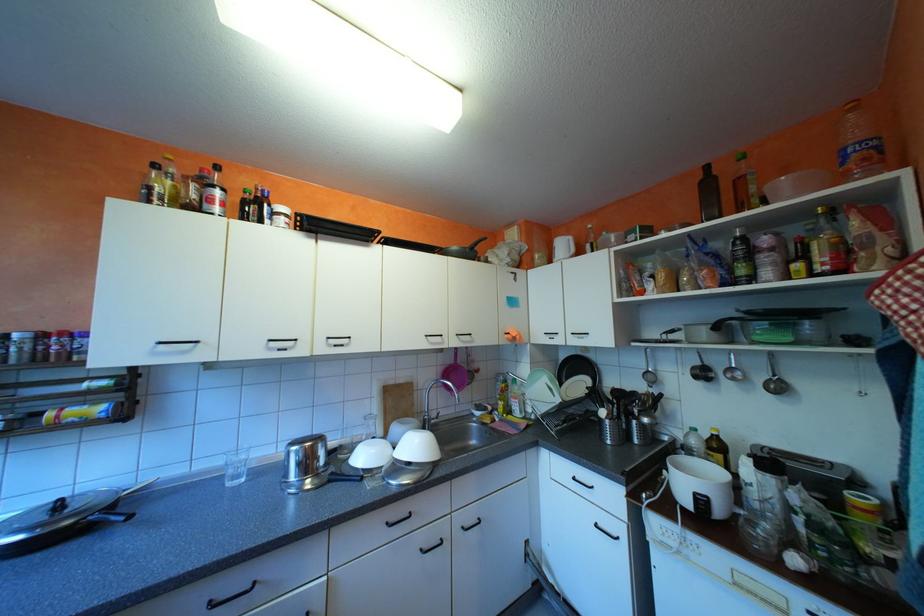
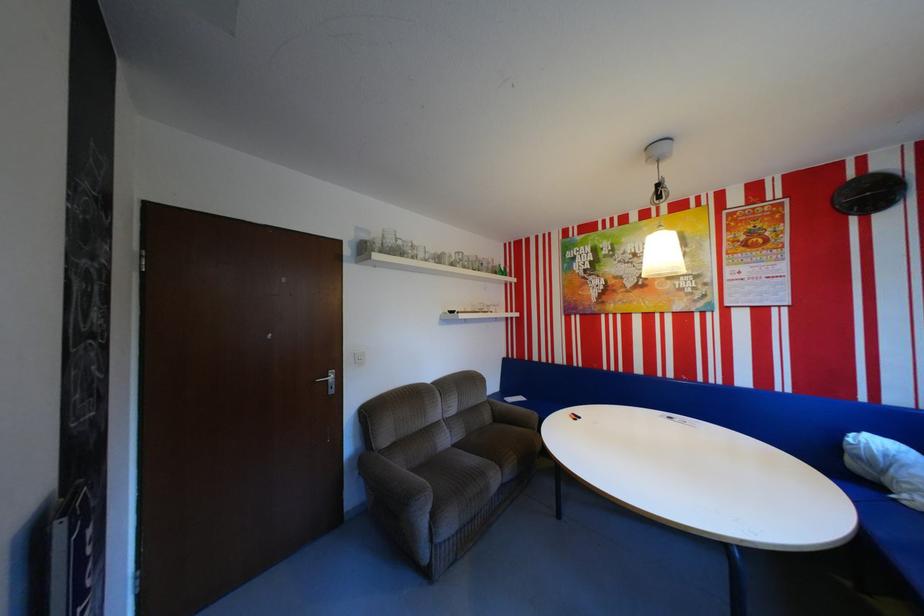
Question: Based on the continuous images, in which direction is the camera rotating? Reply with the corresponding letter.

Choices:
 (A) Left
 (B) Right
 (C) Up
 (D) Down

Answer: (B)